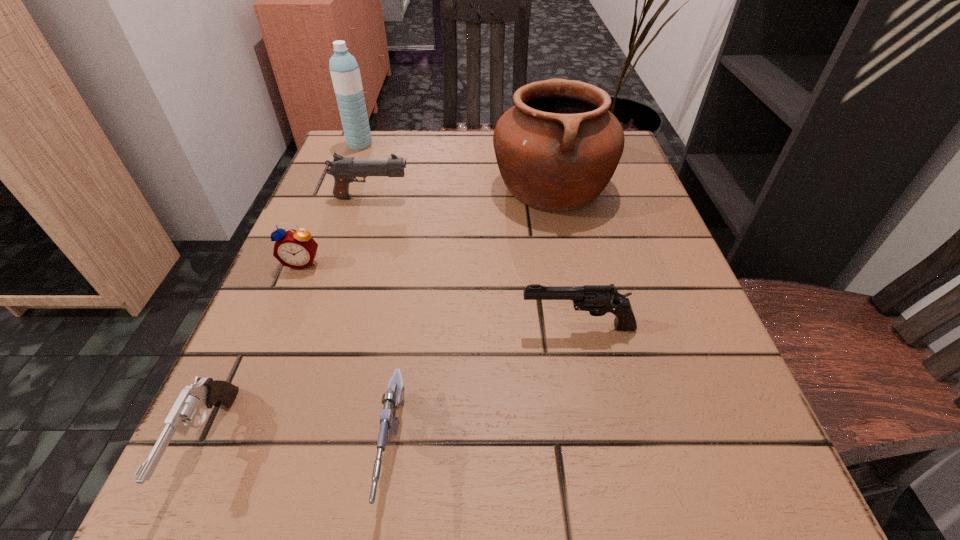
Where is `the tallest object`? the tallest object is located at coordinates (345, 73).

This screenshot has height=540, width=960. What are the coordinates of `water bottle` in the screenshot? It's located at (345, 73).

Where is `the sixth shortest object`? the sixth shortest object is located at coordinates (557, 149).

You are a GUI agent. You are given a task and a screenshot of the screen. Output one action in this format:
    pyautogui.click(x=<x>, y=<y>)
    Task: Click on the second gun from left to right
    
    Given the screenshot: What is the action you would take?
    pyautogui.click(x=344, y=170)

The height and width of the screenshot is (540, 960). Identify the location of the third nearest object. (597, 299).

Image resolution: width=960 pixels, height=540 pixels. I want to click on the rightmost gun, so click(x=597, y=299).

The image size is (960, 540). Identify the location of the fourth farthest object. (296, 249).

Image resolution: width=960 pixels, height=540 pixels. I want to click on the leftmost gun, so click(x=205, y=393).

At what (x,y) coordinates should I click in order to perform the action: click on the fifth object from left to right. Please return your answer as a coordinate pair (x, y). Looking at the image, I should click on (393, 399).

At what (x,y) coordinates should I click in order to perform the action: click on vacant space located on the right of the farthest object. Please return your answer as a coordinate pair (x, y). This screenshot has height=540, width=960. Looking at the image, I should click on (504, 145).